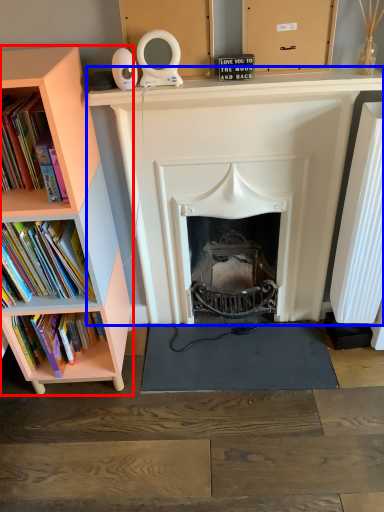
Question: Which object is further to the camera taking this photo, bookcase (highlighted by a red box) or fireplace (highlighted by a blue box)?

Choices:
 (A) bookcase
 (B) fireplace

Answer: (B)